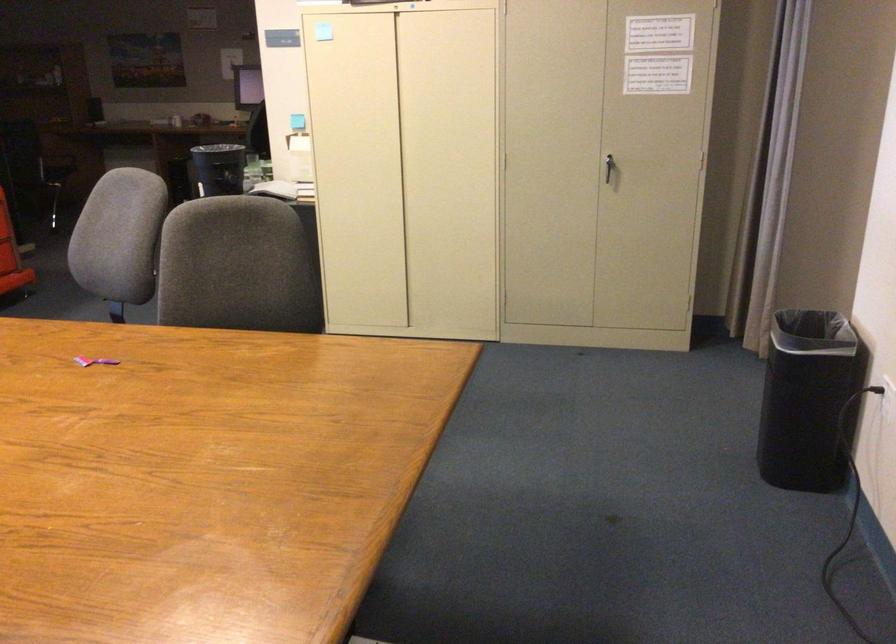
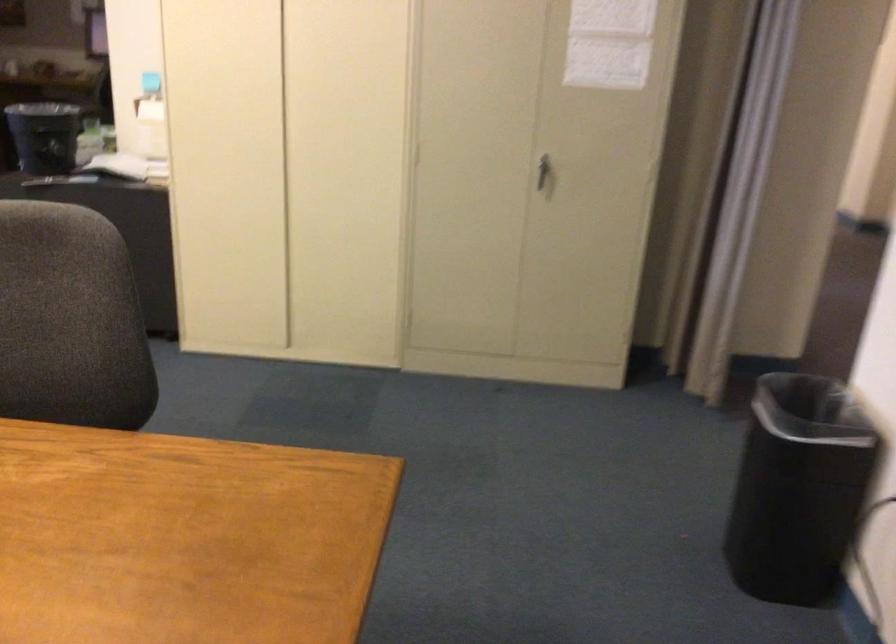
Question: Which direction would the cameraman need to move to produce the second image? Reply with the corresponding letter.

Choices:
 (A) Left
 (B) Right
 (C) Forward
 (D) Backward

Answer: (C)